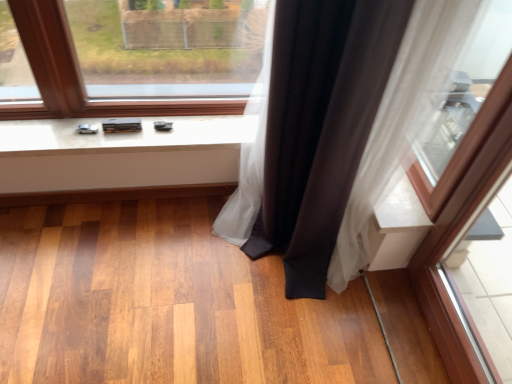
This screenshot has width=512, height=384. What do you see at coordinates (121, 135) in the screenshot?
I see `white matte window sill at center` at bounding box center [121, 135].

Identify the location of white matte window sill at center. (121, 135).

I want to click on white matte window sill at center, so click(121, 135).